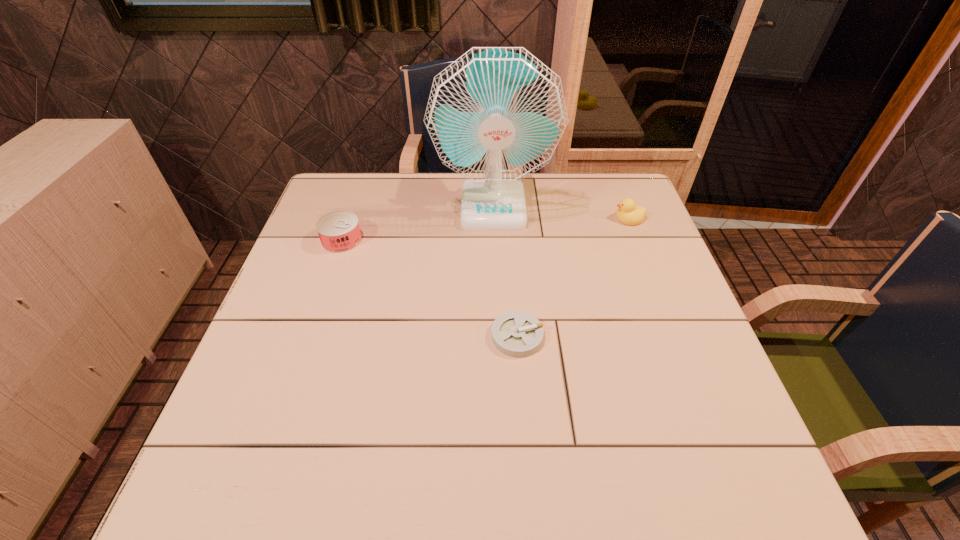
This screenshot has height=540, width=960. In order to click on fan in this screenshot , I will do `click(495, 115)`.

You are a GUI agent. You are given a task and a screenshot of the screen. Output one action in this format:
    pyautogui.click(x=<x>, y=<y>)
    Task: Click on the duckling
    
    Given the screenshot: What is the action you would take?
    pyautogui.click(x=628, y=213)

Where is `the leftmost object`? the leftmost object is located at coordinates (339, 231).

At what (x,y) coordinates should I click in order to perform the action: click on ashtray. Please return your answer as a coordinate pair (x, y). Looking at the image, I should click on (515, 333).

Identify the location of the nearest object. The height and width of the screenshot is (540, 960). (515, 333).

You are a GUI agent. You are given a task and a screenshot of the screen. Output one action in this format:
    pyautogui.click(x=<x>, y=<y>)
    Task: Click on the vacant space situated 0.300m in front of the tallest object to face the airflow
    The image size is (960, 540).
    Given the screenshot: What is the action you would take?
    pyautogui.click(x=497, y=313)

Where is `free space located 0.120m on the face of the rightmost object`? This screenshot has height=540, width=960. free space located 0.120m on the face of the rightmost object is located at coordinates (573, 218).

At what (x,y) coordinates should I click in order to perform the action: click on blank space located on the face of the rightmost object. Please return your answer as a coordinate pair (x, y). Image resolution: width=960 pixels, height=540 pixels. Looking at the image, I should click on (477, 218).

Image resolution: width=960 pixels, height=540 pixels. What are the coordinates of `blank area located on the face of the rightmost object` in the screenshot? It's located at (593, 218).

Find the location of a particular element. This screenshot has width=960, height=540. vacant space located 0.290m on the right of the leftmost object is located at coordinates (466, 240).